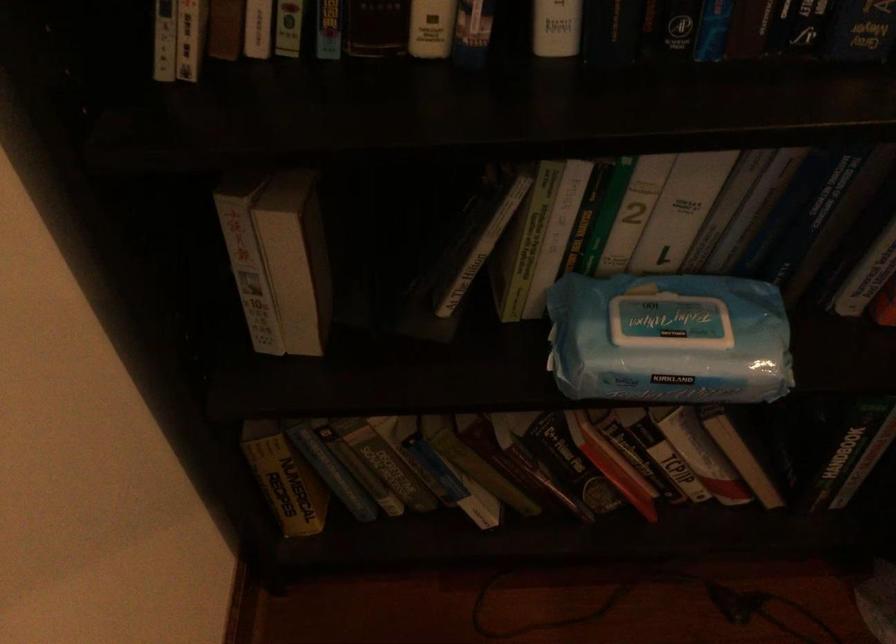
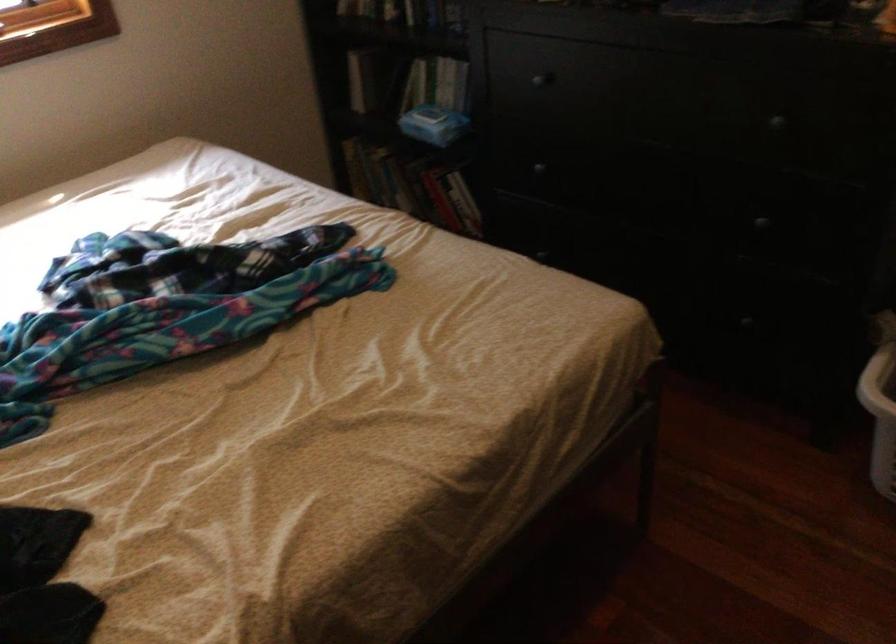
Locate, in the second image, the point that corresponds to point (558, 474) in the first image.

(418, 187)